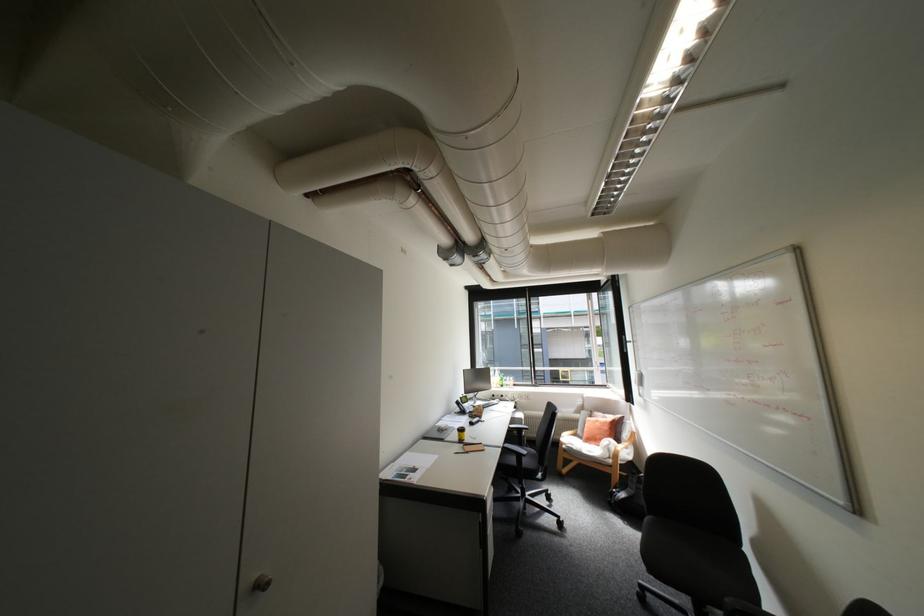
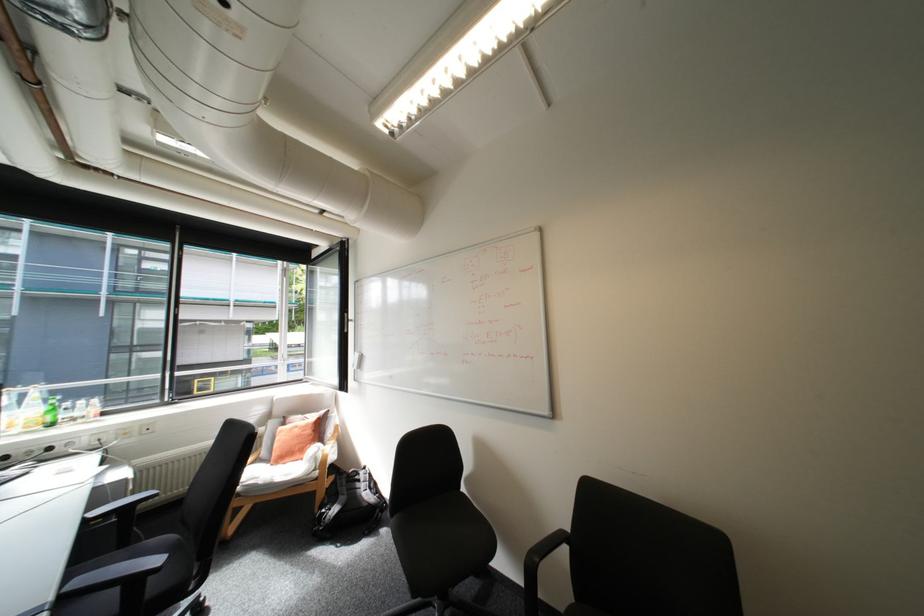
Question: The images are taken continuously from a first-person perspective. In which direction is your viewpoint rotating?

Choices:
 (A) Left
 (B) Right
 (C) Up
 (D) Down

Answer: (B)